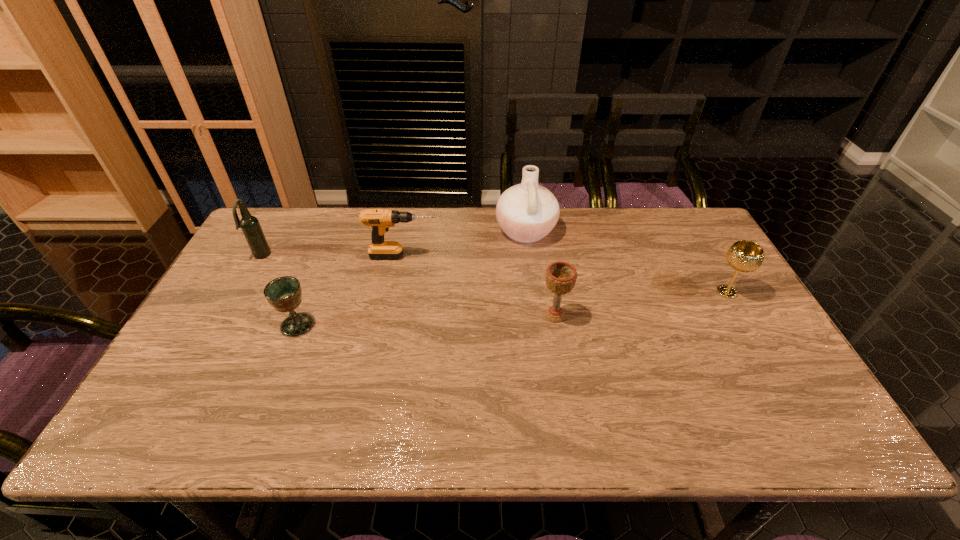
Identify the location of pottery. This screenshot has height=540, width=960. (527, 212).

Locate an element on the screen. This screenshot has width=960, height=540. beer bottle is located at coordinates (251, 228).

Image resolution: width=960 pixels, height=540 pixels. I want to click on the third object from left to right, so click(380, 220).

The height and width of the screenshot is (540, 960). Identify the location of the second chalice from right to left. (561, 276).

The image size is (960, 540). Identify the location of the rightmost object. (744, 256).

Identify the location of the third nearest object. The height and width of the screenshot is (540, 960). tap(744, 256).

At what (x,y) coordinates should I click in order to perform the action: click on the shortest object. Please return your answer as a coordinate pair (x, y). Looking at the image, I should click on (284, 293).

Image resolution: width=960 pixels, height=540 pixels. I want to click on the leftmost chalice, so click(284, 293).

Where is `vacant region located to pour from the handle of the pottery`? The image size is (960, 540). vacant region located to pour from the handle of the pottery is located at coordinates (471, 231).

You are a GUI agent. You are given a task and a screenshot of the screen. Output one action in this format:
    pyautogui.click(x=<x>, y=<y>)
    Task: Click on the vacant space located to pour from the handle of the pottery
    This screenshot has height=540, width=960.
    Given the screenshot: What is the action you would take?
    pyautogui.click(x=403, y=231)